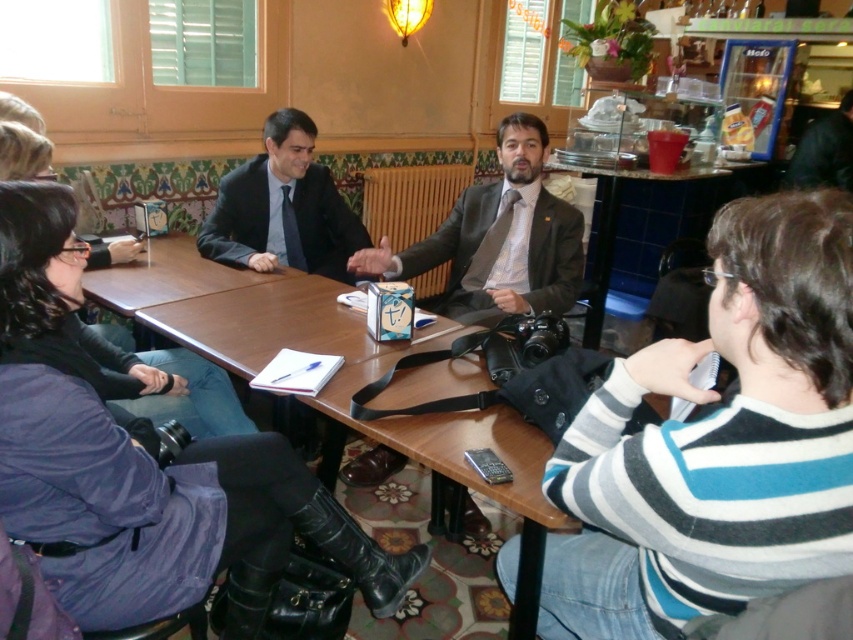
Is matte black suit at center below brown textured suit at center?

Incorrect, matte black suit at center is not positioned below brown textured suit at center.

Does matte black suit at center appear on the left side of brown textured suit at center?

Yes, matte black suit at center is to the left of brown textured suit at center.

Is point (521, 304) positioned after point (537, 307)?

That is False.

Locate an element on the screen. The width and height of the screenshot is (853, 640). matte black suit at center is located at coordinates (498, 240).

Between dark gray suit at center and brown textured suit at center, which one appears on the right side from the viewer's perspective?

From the viewer's perspective, brown textured suit at center appears more on the right side.

Can you confirm if dark gray suit at center is thinner than brown textured suit at center?

Yes, dark gray suit at center is thinner than brown textured suit at center.

Identify the location of dark gray suit at center. (236, 216).

Who is positioned more to the left, matte purple coat at lower left or dark gray suit at center?

From the viewer's perspective, dark gray suit at center appears more on the left side.

Locate an element on the screen. This screenshot has width=853, height=640. matte purple coat at lower left is located at coordinates (142, 468).